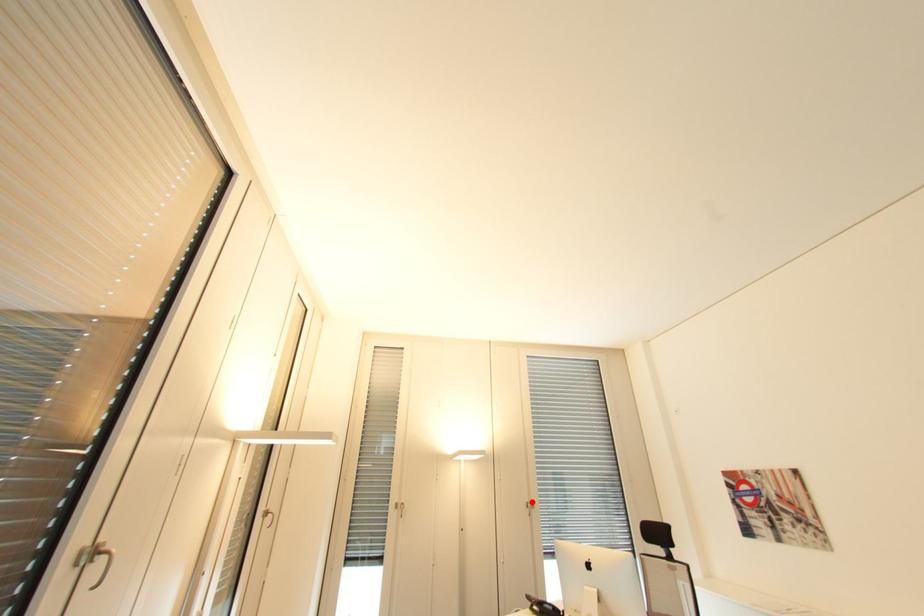
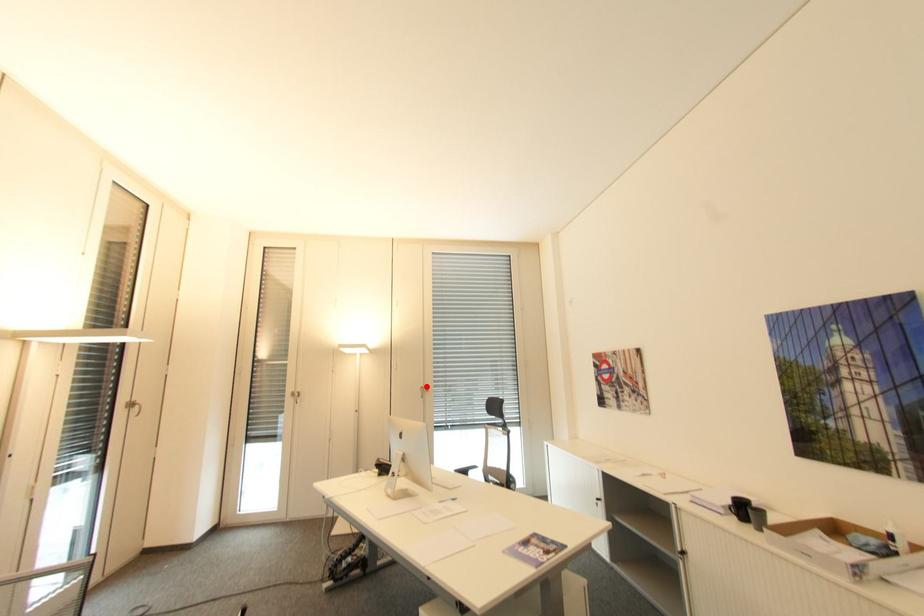
From the picture: I am providing you with two images of the same scene from different viewpoints. A red point is marked on the first image and another point is marked on the second image. Is the marked point in image1 the same physical position as the marked point in image2?

Yes